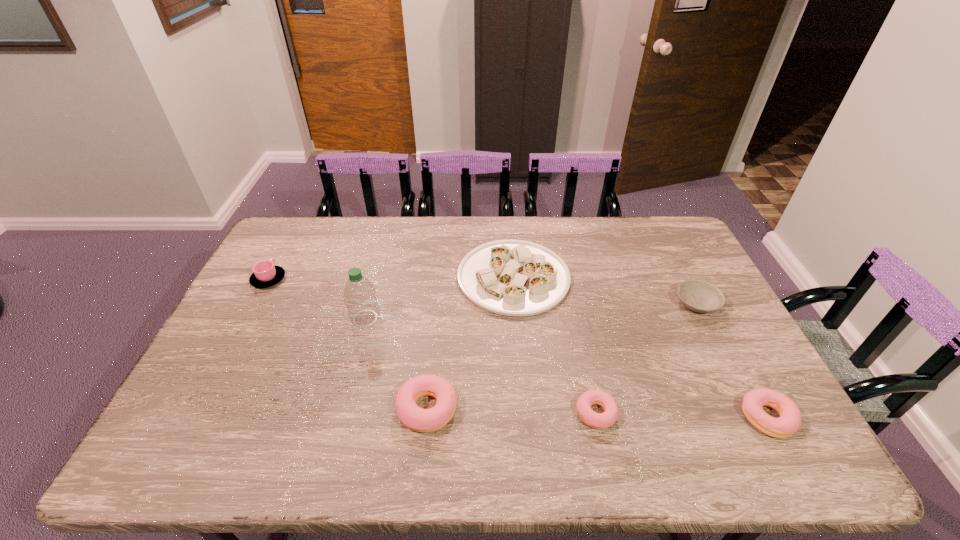
Considering the uniform spacing of doughnuts, where should an additional doughnut be positioned on the left? Please locate a free spot. Please provide its 2D coordinates. Your answer should be formatted as a tuple, i.e. [(x, y)], where the tuple contains the x and y coordinates of a point satisfying the conditions above.

[(260, 406)]